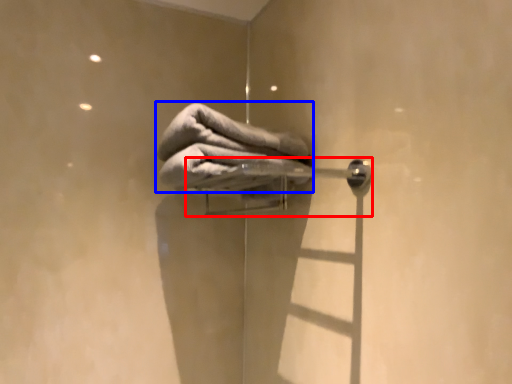
Question: Which object appears farthest to the camera in this image, door handle (highlighted by a red box) or towel (highlighted by a blue box)?

Choices:
 (A) door handle
 (B) towel

Answer: (B)